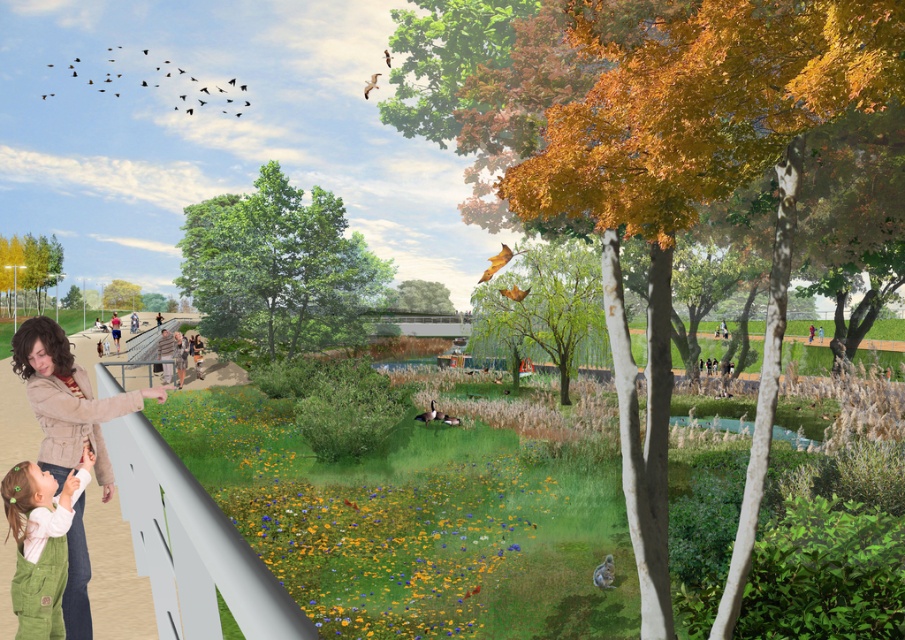
In the park scene, there is a woman wearing a matte beige jacket at lower left and a young child in light pink top and green overalls. If the child wants to reach the point marked by coordinates point (65, 400), which is located at the position of the matte beige jacket at lower left, which direction should they move relative to their current position?

The point marked by coordinates point (65, 400) is located at the position of the matte beige jacket at lower left, so the child should move towards the lower left direction to reach it.

You are a photographer standing at the park entrance and want to take a photo of the matte beige jacket at lower left and the green corduroy overalls at lower left. Which object should you focus on first to ensure both are in sharp focus?

You should focus on the matte beige jacket at lower left first because it is closer to you than the green corduroy overalls at lower left, ensuring both will be in focus when focused on the closer object.